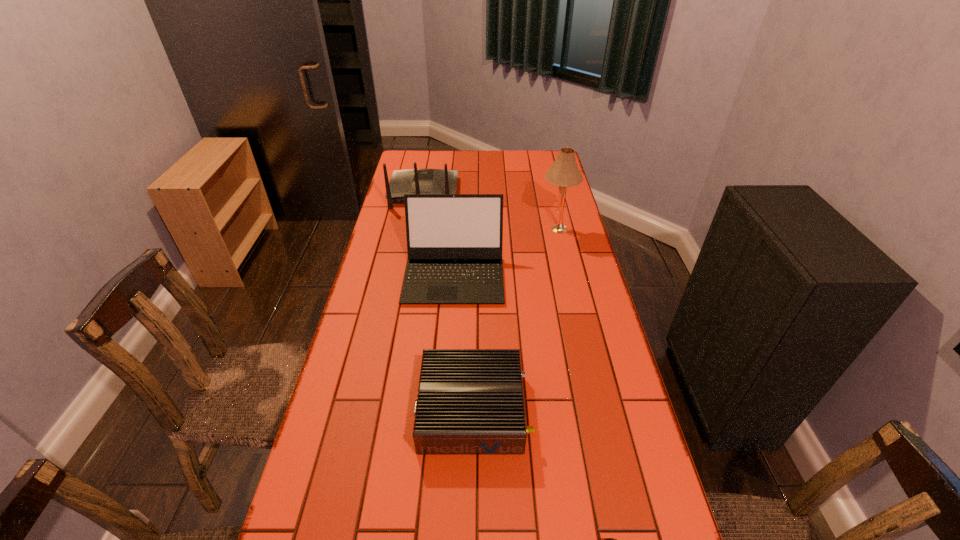
Locate an element on the screen. Image resolution: width=960 pixels, height=540 pixels. empty location between the fourth farthest object and the second farthest object is located at coordinates (515, 320).

The height and width of the screenshot is (540, 960). Identify the location of free space between the shorter router and the third nearest object. (464, 342).

The image size is (960, 540). In order to click on vacant area that lies between the nearer router and the tallest object in this screenshot , I will do `click(515, 320)`.

Find the location of a particular element. object that is the second closest to the farther router is located at coordinates (564, 172).

You are a GUI agent. You are given a task and a screenshot of the screen. Output one action in this format:
    pyautogui.click(x=<x>, y=<y>)
    Task: Click on the object that stands as the second closest to the nearer router
    
    Given the screenshot: What is the action you would take?
    pyautogui.click(x=454, y=241)